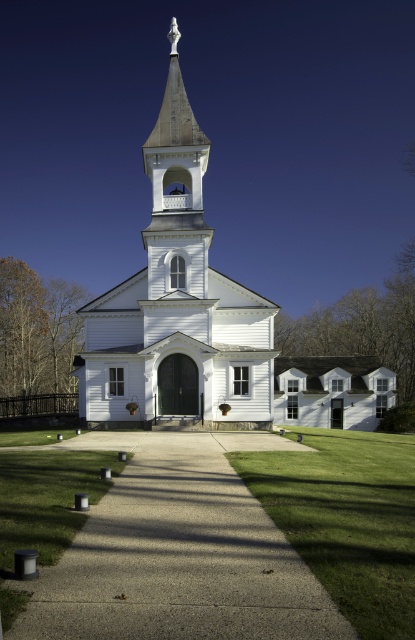
Consider the image. You are a visitor approaching the church and notice the gray concrete path at center and the white wooden church at center. Which one takes up more space in the image?

The white wooden church at center occupies more space than the gray concrete path at center.

You are standing at the entrance of the white church and want to take a photo of the gray concrete path at center. Where should you position yourself to capture the path in the center of your camera view?

You should position yourself at the entrance of the white church and aim your camera towards the point at coordinates (178, 552) where the gray concrete path at center is located to capture it in the center of your camera view.